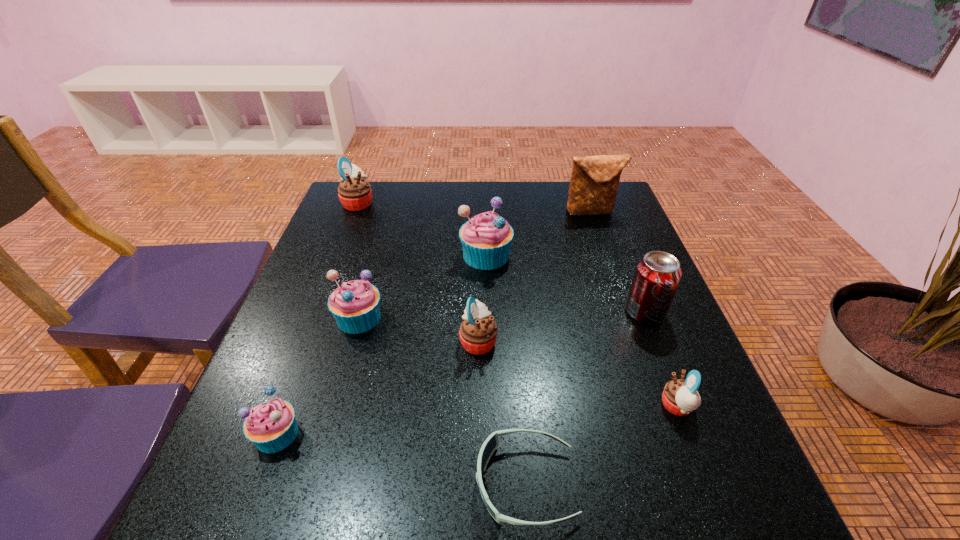
Where is `clutch bag`? The height and width of the screenshot is (540, 960). clutch bag is located at coordinates (594, 182).

Locate an element on the screen. This screenshot has height=540, width=960. the biggest pink muffin is located at coordinates (354, 192).

At what (x,y) coordinates should I click in order to perform the action: click on the farthest muffin. Please return your answer as a coordinate pair (x, y). The image size is (960, 540). Looking at the image, I should click on (354, 192).

Locate an element on the screen. Image resolution: width=960 pixels, height=540 pixels. the rightmost blue muffin is located at coordinates (486, 239).

Image resolution: width=960 pixels, height=540 pixels. Find the location of `the seventh nearest object`. the seventh nearest object is located at coordinates (486, 239).

Where is `soda can`? Image resolution: width=960 pixels, height=540 pixels. soda can is located at coordinates (657, 275).

Where is `the second biggest pink muffin`? the second biggest pink muffin is located at coordinates (478, 332).

You are a GUI agent. You are given a task and a screenshot of the screen. Output one action in this format:
    pyautogui.click(x=<x>, y=<y>)
    Task: Click on the second farthest pink muffin
    The height and width of the screenshot is (540, 960).
    Given the screenshot: What is the action you would take?
    pyautogui.click(x=478, y=332)

Locate an element on the screen. the second nearest blue muffin is located at coordinates (355, 304).

The width and height of the screenshot is (960, 540). Identify the location of the smallest blue muffin. (271, 426).